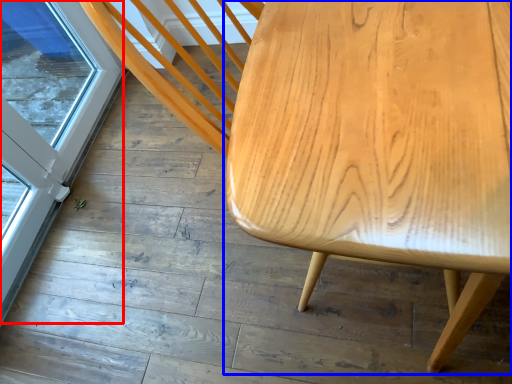
Question: Which point is further to the camera, screen door (highlighted by a red box) or table (highlighted by a blue box)?

Choices:
 (A) screen door
 (B) table

Answer: (A)